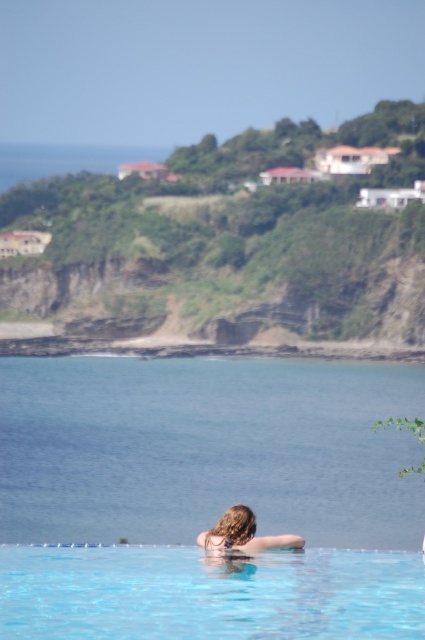
In the scene shown: How far apart are clear glass pool at center and blonde hair at upper center?

clear glass pool at center and blonde hair at upper center are 17.30 meters apart from each other.

Is clear glass pool at center wider than blonde hair at upper center?

Indeed, clear glass pool at center has a greater width compared to blonde hair at upper center.

Image resolution: width=425 pixels, height=640 pixels. What are the coordinates of `clear glass pool at center` in the screenshot? It's located at (207, 595).

Does point (34, 404) come behind point (226, 516)?

Yes.

The height and width of the screenshot is (640, 425). Identify the location of transparent blue water at center. (207, 449).

What do you see at coordinates (207, 449) in the screenshot? I see `transparent blue water at center` at bounding box center [207, 449].

Locate an element on the screen. transparent blue water at center is located at coordinates (207, 449).

Can you confirm if transparent blue water at center is shorter than clear glass pool at center?

No.

Does transparent blue water at center have a smaller size compared to clear glass pool at center?

Incorrect, transparent blue water at center is not smaller in size than clear glass pool at center.

Does point (192, 488) come in front of point (57, 566)?

No, (192, 488) is behind (57, 566).

At what (x,y) coordinates should I click in order to perform the action: click on transparent blue water at center. Please return your answer as a coordinate pair (x, y). The image size is (425, 640). Looking at the image, I should click on (207, 449).